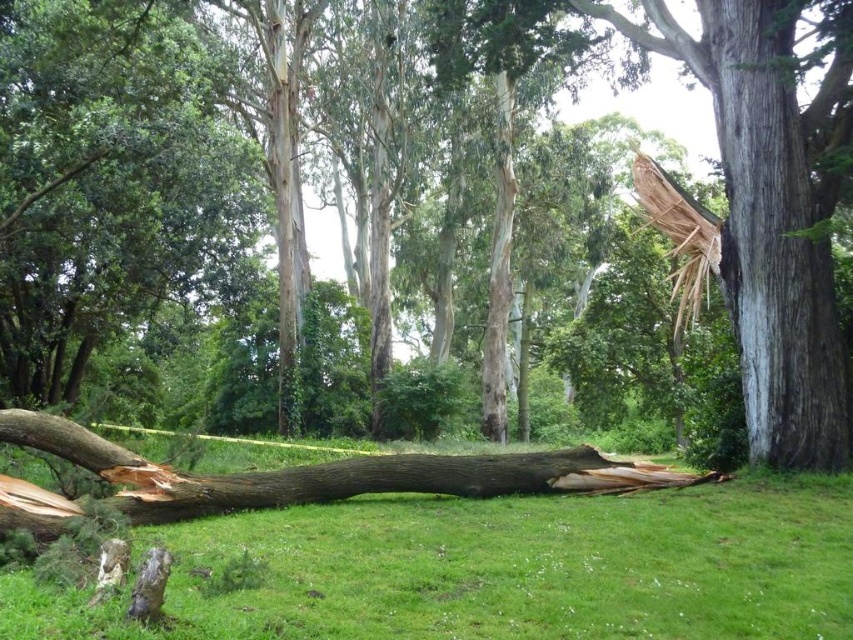
You are a park ranger assessing damage after a storm. You notice two objects in the scene described. Which one is narrower in width between the brown rough wood at center and the brown rough tree trunk at center?

The brown rough wood at center is narrower in width compared to the brown rough tree trunk at center.

You are a hiker who has stumbled upon this scene. You need to cross the area where the brown rough wood at center and the brown rough tree trunk at center are located. Which object is taller, making it a better landmark to use for navigation?

The brown rough tree trunk at center is taller than the brown rough wood at center, so it would be a better landmark for navigation.